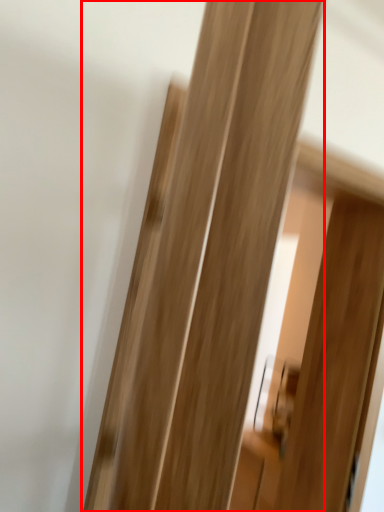
Question: From the image's perspective, what is the correct spatial relationship of door (annotated by the red box) in relation to screen door?

Choices:
 (A) above
 (B) below

Answer: (A)